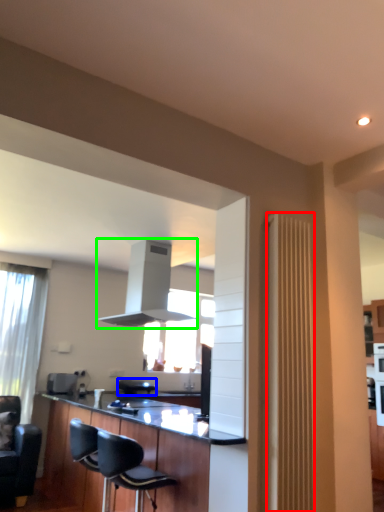
Question: Which object is the farthest from radiator (highlighted by a red box)? Choose among these: armchair (highlighted by a blue box) or exhaust hood (highlighted by a green box).

Choices:
 (A) armchair
 (B) exhaust hood

Answer: (A)